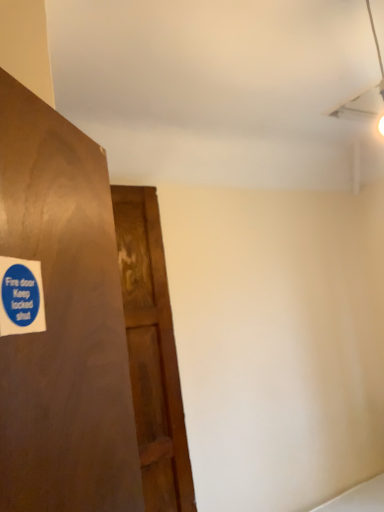
Question: Is blue paper sticker at left spatially inside wooden door at left, or outside of it?

Choices:
 (A) inside
 (B) outside

Answer: (B)

Question: Is blue paper sticker at left to the left or to the right of wooden door at left in the image?

Choices:
 (A) right
 (B) left

Answer: (B)

Question: Looking at their shapes, would you say blue paper sticker at left is wider or thinner than wooden door at left?

Choices:
 (A) wide
 (B) thin

Answer: (B)

Question: Based on their sizes in the image, would you say wooden door at left is bigger or smaller than blue paper sticker at left?

Choices:
 (A) big
 (B) small

Answer: (A)

Question: In the image, is wooden door at left on the left side or the right side of blue paper sticker at left?

Choices:
 (A) right
 (B) left

Answer: (A)

Question: Does point (147, 398) appear closer or farther from the camera than point (23, 292)?

Choices:
 (A) closer
 (B) farther

Answer: (B)

Question: From a real-world perspective, is wooden door at left above or below blue paper sticker at left?

Choices:
 (A) above
 (B) below

Answer: (B)